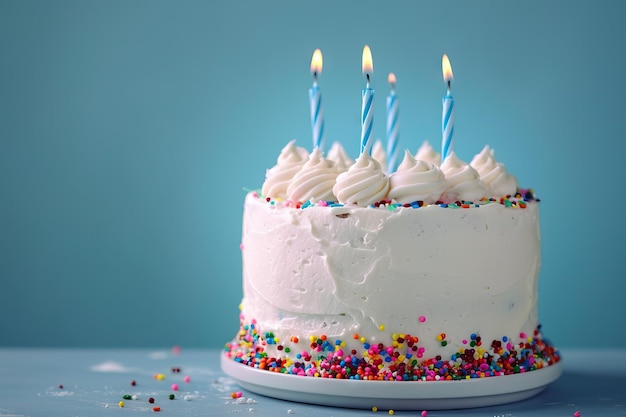
This screenshot has height=417, width=626. What are the coordinates of `blue and white striped birthday candles` in the screenshot? It's located at (447, 127), (386, 124), (360, 129), (315, 114).